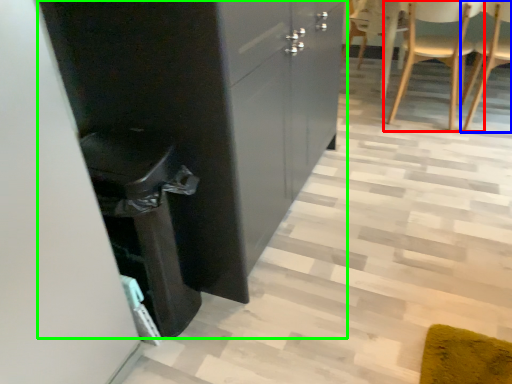
Question: Estimate the real-world distances between objects in this image. Which object is closer to chair (highlighted by a red box), chair (highlighted by a blue box) or cabinetry (highlighted by a green box)?

Choices:
 (A) chair
 (B) cabinetry

Answer: (A)